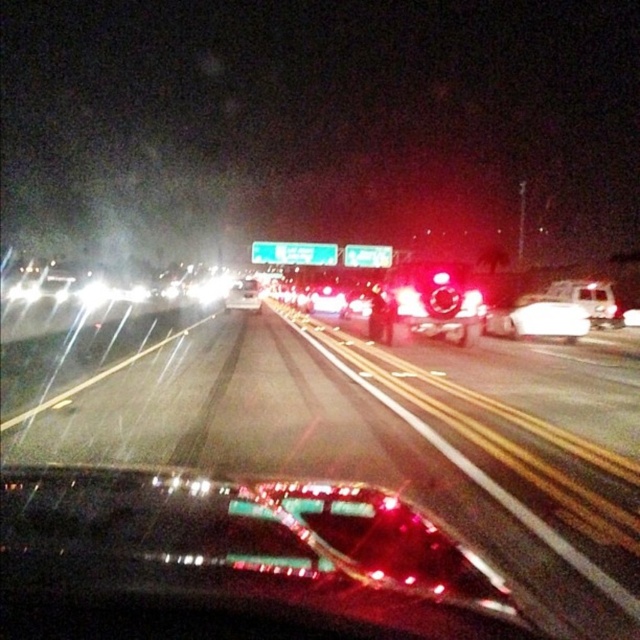
You are driving at night on a wet highway and see two cars ahead. The glossy reflective car at center and the glossy plastic car at center. Which one is positioned higher in the image?

The glossy reflective car at center is positioned higher than the glossy plastic car at center in the image.

You are driving at night on a wet highway and see the glossy reflective car at center and the metallic silver ambulance at right. Which vehicle is closer to you based on their positions?

The glossy reflective car at center is closer because it is positioned below the metallic silver ambulance at right, indicating it is nearer in the visual perspective.